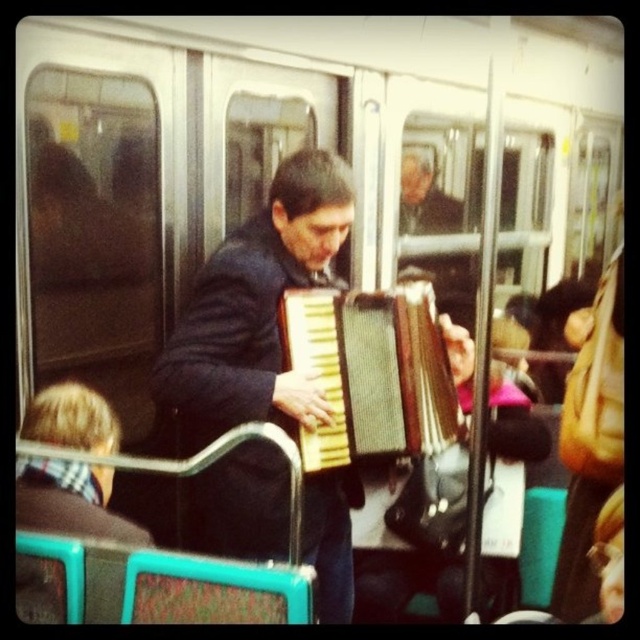
Question: Which object is closer to the camera taking this photo?

Choices:
 (A) wooden accordion at center
 (B) dark blue fabric accordion at center

Answer: (B)

Question: Which object appears farthest from the camera in this image?

Choices:
 (A) dark blue fabric accordion at center
 (B) wooden accordion at center

Answer: (B)

Question: Which point is farther from the camera taking this photo?

Choices:
 (A) (413, 396)
 (B) (275, 216)

Answer: (A)

Question: Can you confirm if dark blue fabric accordion at center is positioned above wooden accordion at center?

Choices:
 (A) yes
 (B) no

Answer: (B)

Question: Does dark blue fabric accordion at center appear under wooden accordion at center?

Choices:
 (A) yes
 (B) no

Answer: (A)

Question: Is dark blue fabric accordion at center to the right of wooden accordion at center from the viewer's perspective?

Choices:
 (A) yes
 (B) no

Answer: (B)